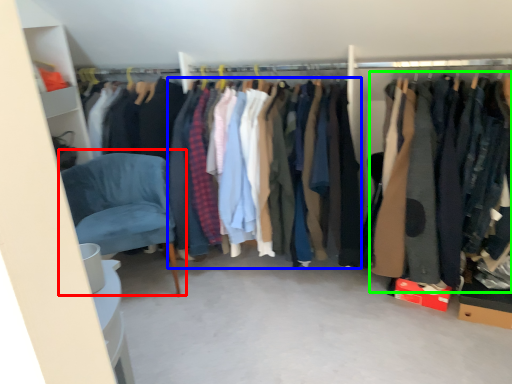
Question: Considering the real-world distances, which object is farthest from chair (highlighted by a red box)? clothing (highlighted by a blue box) or clothing (highlighted by a green box)?

Choices:
 (A) clothing
 (B) clothing

Answer: (B)